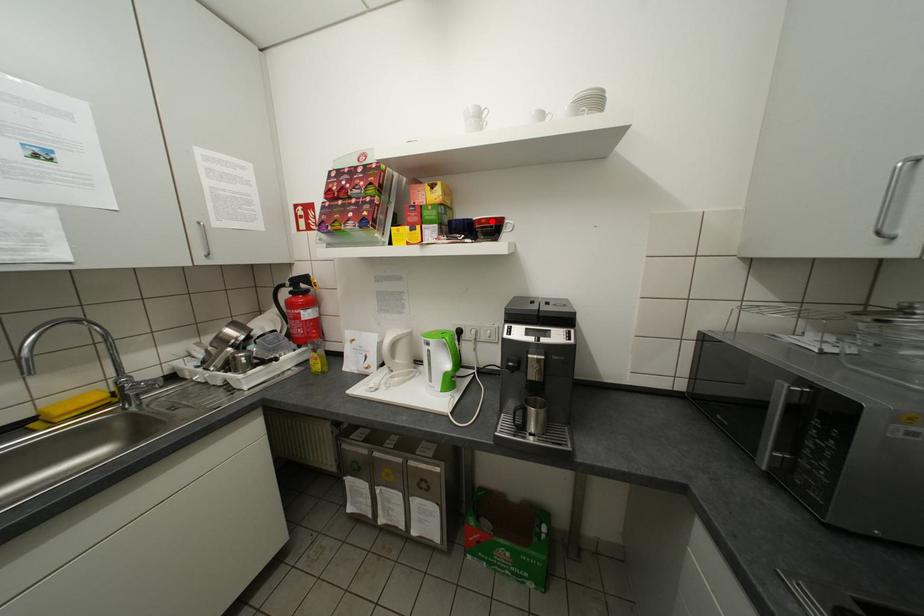
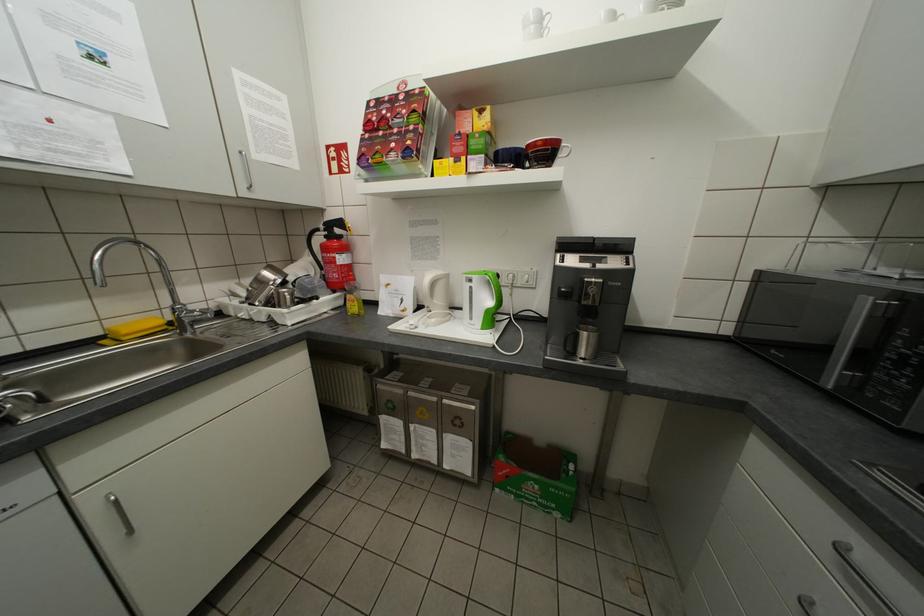
The point at the highlighted location is marked in the first image. Where is the corresponding point in the second image?

(548, 144)